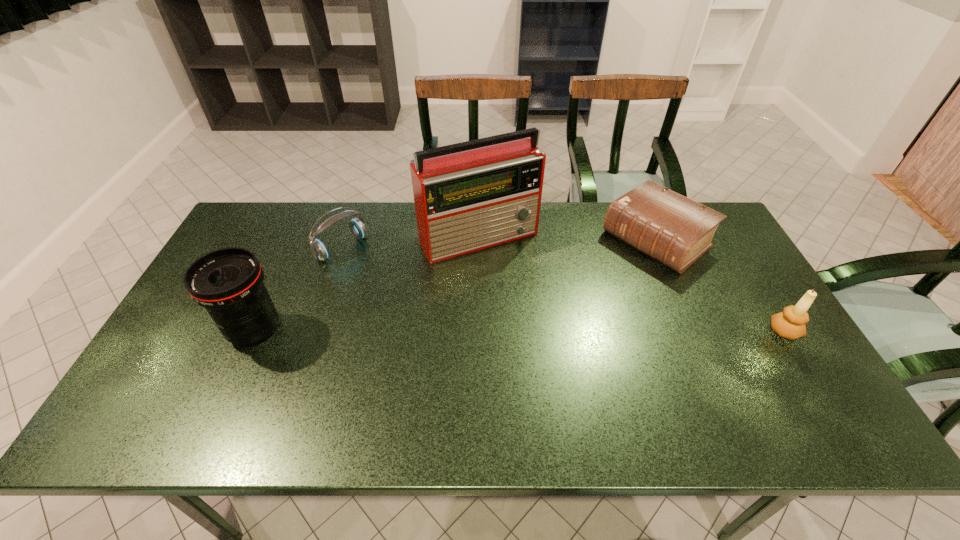
Where is `free space on the desktop that is between the fourth shortest object and the rightmost object and is positioned on the spine side of the Bible`? free space on the desktop that is between the fourth shortest object and the rightmost object and is positioned on the spine side of the Bible is located at coordinates (533, 331).

I want to click on vacant spot on the desktop that is between the telephoto lens and the candle_holder and is positioned on the ear cups of the headset, so click(448, 330).

Find the location of `vacant spot on the desktop that is between the fourth shortest object and the rightmost object and is positioned on the front-facing side of the tallest object`. vacant spot on the desktop that is between the fourth shortest object and the rightmost object and is positioned on the front-facing side of the tallest object is located at coordinates (541, 331).